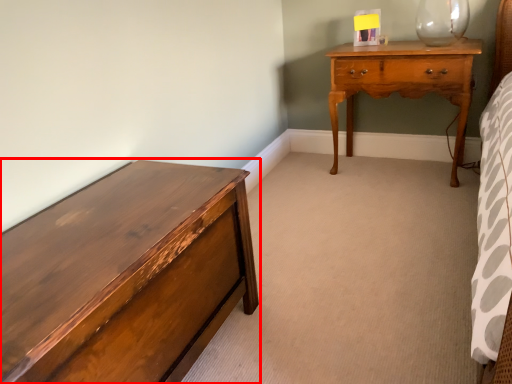
Question: Considering the relative positions of chest of drawers (annotated by the red box) and nightstand in the image provided, where is chest of drawers (annotated by the red box) located with respect to the staircase?

Choices:
 (A) right
 (B) left

Answer: (B)